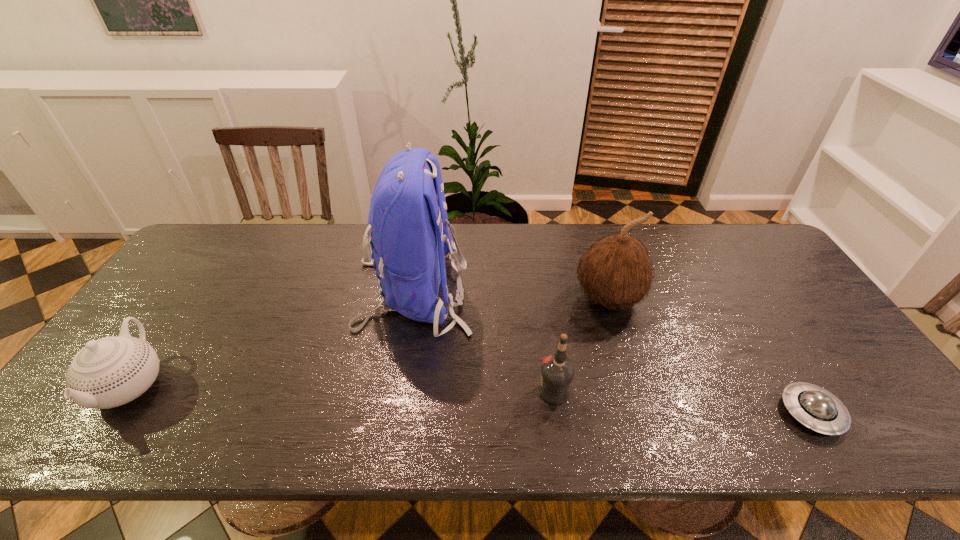
Identify the location of vacant position in the image that satisfies the following two spatial constraints: 1. on the front label of the rightmost object; 2. on the left side of the third object from right to left. (557, 413).

Locate an element on the screen. This screenshot has width=960, height=540. free space that satisfies the following two spatial constraints: 1. on the front label of the shortest object; 2. on the right side of the third object from left to right is located at coordinates (557, 413).

The width and height of the screenshot is (960, 540). In order to click on vacant position in the image that satisfies the following two spatial constraints: 1. on the back of the tallest object; 2. on the spout of the leftmost object in this screenshot , I will do `click(398, 385)`.

The width and height of the screenshot is (960, 540). Find the location of `vacant space that satisfies the following two spatial constraints: 1. on the surface of the saucer; 2. on the right side of the fourth object from left to right`. vacant space that satisfies the following two spatial constraints: 1. on the surface of the saucer; 2. on the right side of the fourth object from left to right is located at coordinates (643, 413).

Identify the location of free location that satisfies the following two spatial constraints: 1. on the back of the rightmost object; 2. on the right side of the fourth object from right to left. (394, 413).

The image size is (960, 540). What are the coordinates of `vacant space that satisfies the following two spatial constraints: 1. on the back of the fourth object from right to left; 2. on the spout of the chinaware` in the screenshot? It's located at (398, 385).

The image size is (960, 540). What are the coordinates of `free space that satisfies the following two spatial constraints: 1. on the back of the backpack; 2. on the spout of the leftmost object` in the screenshot? It's located at (398, 385).

What are the coordinates of `vacant position in the image that satisfies the following two spatial constraints: 1. on the spout of the chinaware; 2. on the right side of the rightmost object` in the screenshot? It's located at (112, 413).

Locate an element on the screen. This screenshot has height=540, width=960. free region that satisfies the following two spatial constraints: 1. on the surface of the rightmost object; 2. on the left side of the second object from right to left is located at coordinates (643, 413).